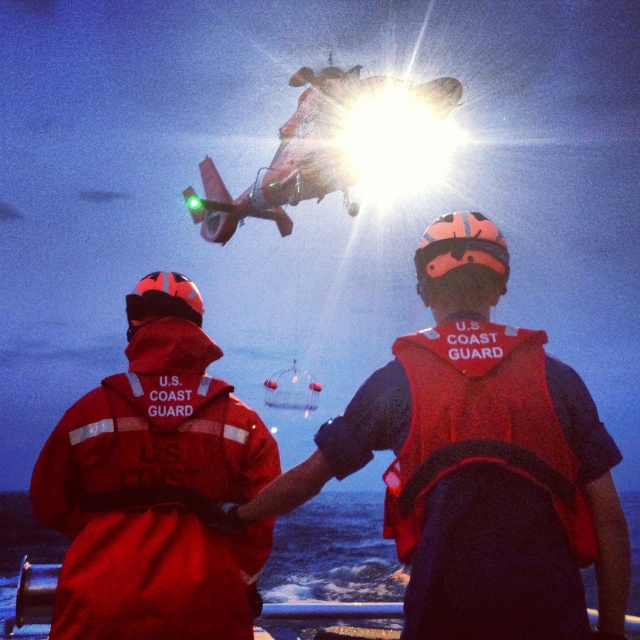
From the picture: Between orange life vest at center and red fabric life jacket at center, which one appears on the right side from the viewer's perspective?

Positioned to the right is red fabric life jacket at center.

Is orange life vest at center above red fabric life jacket at center?

No, orange life vest at center is not above red fabric life jacket at center.

You are a GUI agent. You are given a task and a screenshot of the screen. Output one action in this format:
    pyautogui.click(x=<x>, y=<y>)
    Task: Click on the orange life vest at center
    This screenshot has height=640, width=640.
    Given the screenshot: What is the action you would take?
    pyautogui.click(x=481, y=496)

Can you confirm if red fabric life jacket at center is wider than red fabric boat at lower center?

No.

Who is shorter, red fabric life jacket at center or red fabric boat at lower center?

red fabric life jacket at center

Locate an element on the screen. The height and width of the screenshot is (640, 640). red fabric life jacket at center is located at coordinates (481, 424).

Identify the location of red fabric life jacket at center. The width and height of the screenshot is (640, 640). (481, 424).

Is red matte uniform at left closer to the viewer compared to red fabric life jacket at center?

No.

Is point (244, 593) closer to viewer compared to point (451, 408)?

No, (244, 593) is further to viewer.

The width and height of the screenshot is (640, 640). I want to click on red matte uniform at left, so click(156, 483).